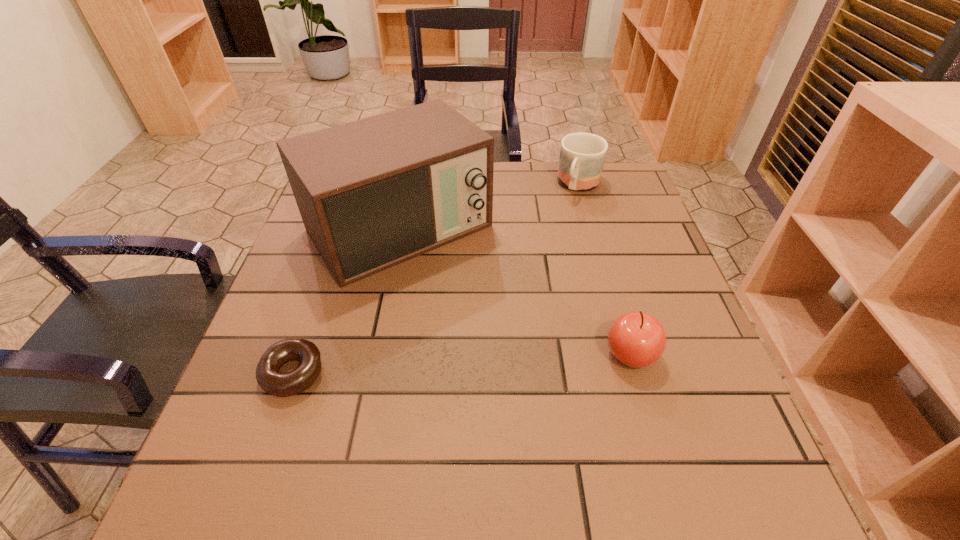
The image size is (960, 540). Find the location of `empty space between the doughnut and the mug`. empty space between the doughnut and the mug is located at coordinates (437, 278).

Image resolution: width=960 pixels, height=540 pixels. Find the location of `unoccupied position between the apple and the shortest object`. unoccupied position between the apple and the shortest object is located at coordinates (463, 363).

Where is `free space between the apple and the doughnut`? free space between the apple and the doughnut is located at coordinates (463, 363).

Image resolution: width=960 pixels, height=540 pixels. What are the coordinates of `unoccupied area between the mug and the apple` in the screenshot? It's located at (605, 269).

Find the location of a particular element. Image resolution: width=960 pixels, height=540 pixels. blank region between the apple and the radio receiver is located at coordinates (516, 291).

Locate an element on the screen. The height and width of the screenshot is (540, 960). free spot between the doughnut and the tallest object is located at coordinates (347, 300).

Choose which object is the second nearest neighbor to the tallest object. Please provide its 2D coordinates. Your answer should be formatted as a tuple, i.e. [(x, y)], where the tuple contains the x and y coordinates of a point satisfying the conditions above.

[(582, 155)]

Where is `object that stands as the second closest to the mug`? object that stands as the second closest to the mug is located at coordinates (636, 339).

The height and width of the screenshot is (540, 960). I want to click on vacant position in the image that satisfies the following two spatial constraints: 1. on the back side of the doughnut; 2. on the left side of the mug, so click(359, 185).